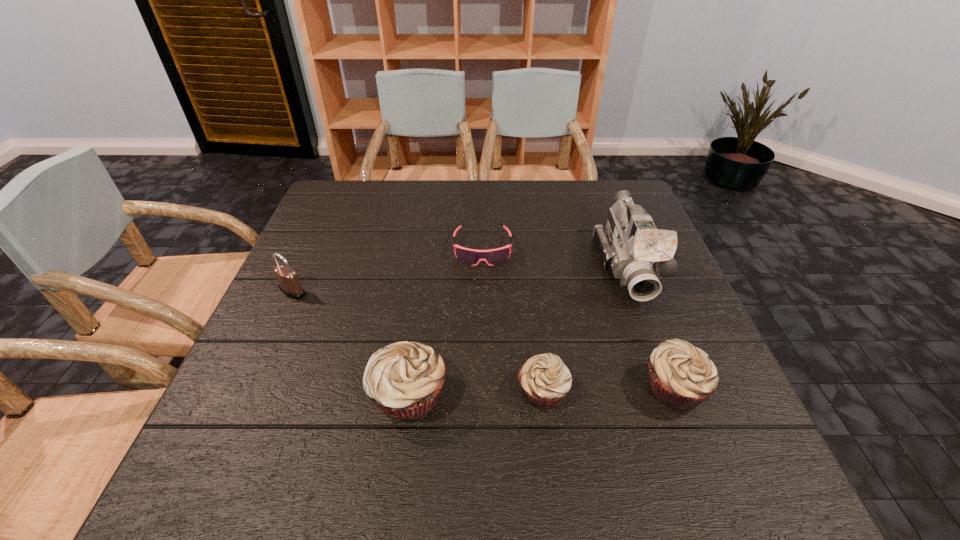
Where is `vacant area situated on the left of the rightmost muffin`? The width and height of the screenshot is (960, 540). vacant area situated on the left of the rightmost muffin is located at coordinates (493, 388).

Find the location of `vacant area situated on the front-facing side of the shortest object`. vacant area situated on the front-facing side of the shortest object is located at coordinates (483, 395).

The width and height of the screenshot is (960, 540). Find the location of `vacant space located 0.380m on the back of the padlock`. vacant space located 0.380m on the back of the padlock is located at coordinates (334, 200).

Where is `vacant point located 0.280m on the front-facing side of the camcorder`? The height and width of the screenshot is (540, 960). vacant point located 0.280m on the front-facing side of the camcorder is located at coordinates (684, 418).

Where is `object at the left edge`? Image resolution: width=960 pixels, height=540 pixels. object at the left edge is located at coordinates (289, 284).

What are the coordinates of `muffin that is at the right edge` in the screenshot? It's located at (682, 376).

At what (x,y) coordinates should I click in order to perform the action: click on camcorder present at the right edge. Please return your answer as a coordinate pair (x, y). The height and width of the screenshot is (540, 960). Looking at the image, I should click on (630, 245).

At what (x,y) coordinates should I click in order to perform the action: click on object that is positioned at the near right corner. Please return your answer as a coordinate pair (x, y). This screenshot has height=540, width=960. Looking at the image, I should click on (682, 376).

At what (x,y) coordinates should I click in order to perform the action: click on blank space at the far edge of the desktop. Please return your answer as a coordinate pair (x, y). Image resolution: width=960 pixels, height=540 pixels. Looking at the image, I should click on (414, 214).

In the image, there is a desktop. Where is `vacant space at the near edge`? This screenshot has height=540, width=960. vacant space at the near edge is located at coordinates (387, 429).